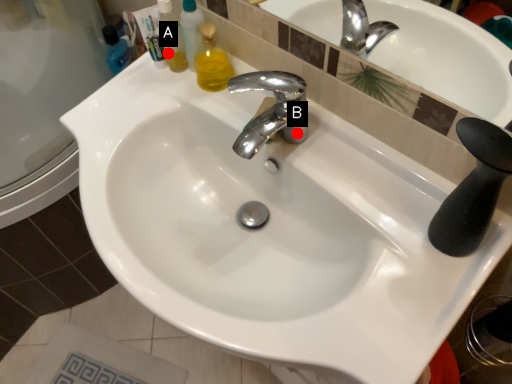
Question: Two points are circled on the image, labeled by A and B beside each circle. Which point is further to the camera?

Choices:
 (A) A is further
 (B) B is further

Answer: (A)